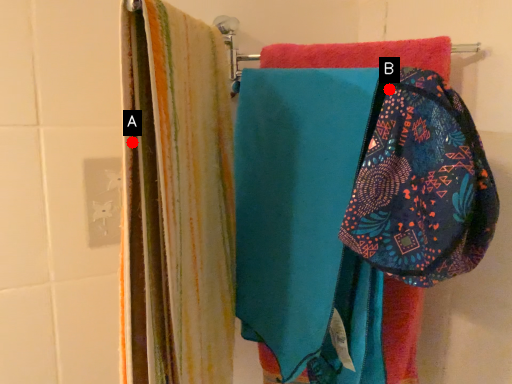
Question: Two points are circled on the image, labeled by A and B beside each circle. Which point appears farthest from the camera in this image?

Choices:
 (A) A is further
 (B) B is further

Answer: (B)